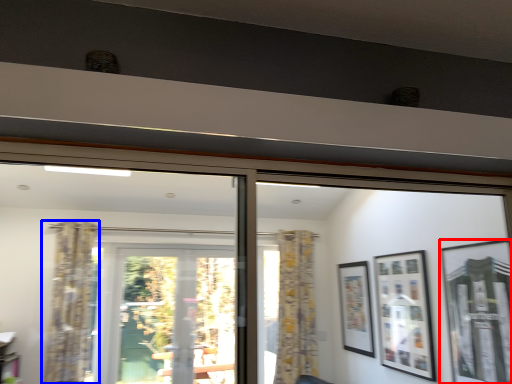
Question: Which object appears closest to the camera in this image, picture frame (highlighted by a red box) or curtain (highlighted by a blue box)?

Choices:
 (A) picture frame
 (B) curtain

Answer: (A)